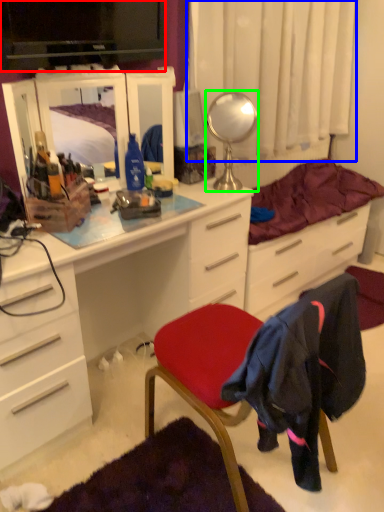
Question: Which object is positioned closest to television (highlighted by a red box)? Select from curtain (highlighted by a blue box) and mirror (highlighted by a green box).

Choices:
 (A) curtain
 (B) mirror

Answer: (B)